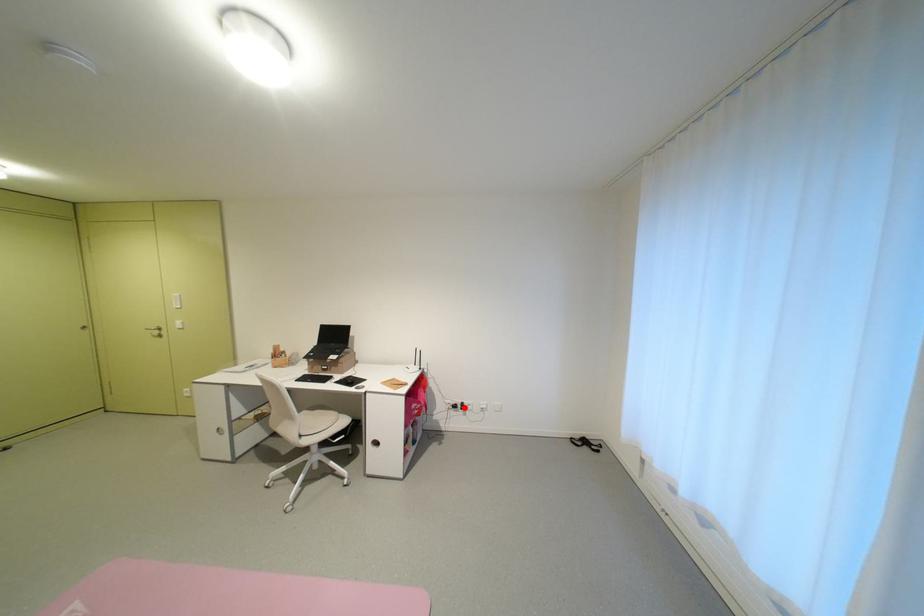
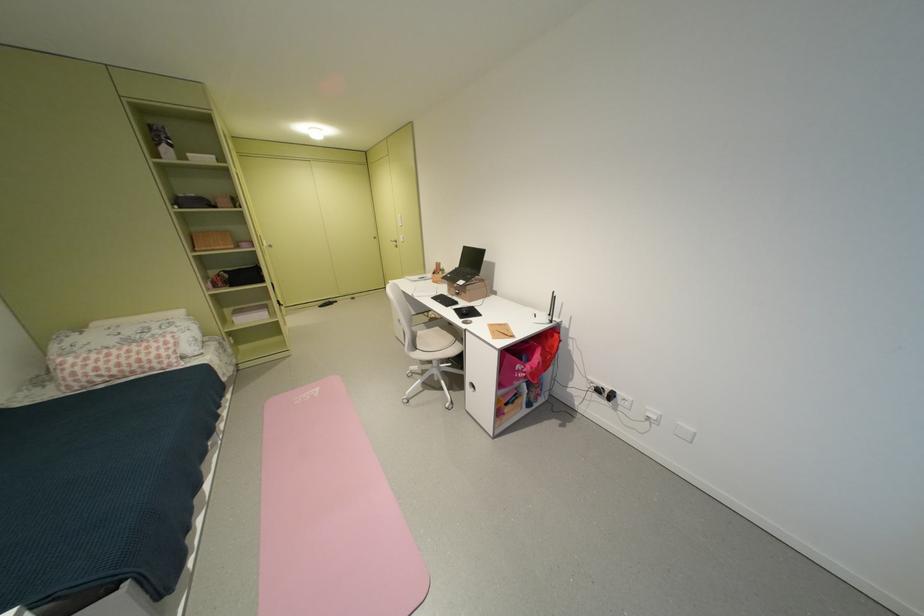
Where in the second image is the point corresponding to the highlighted location from the first image?

(609, 392)